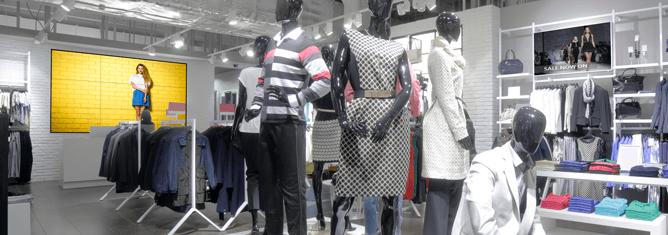
Identify the location of ceiling. (153, 18).